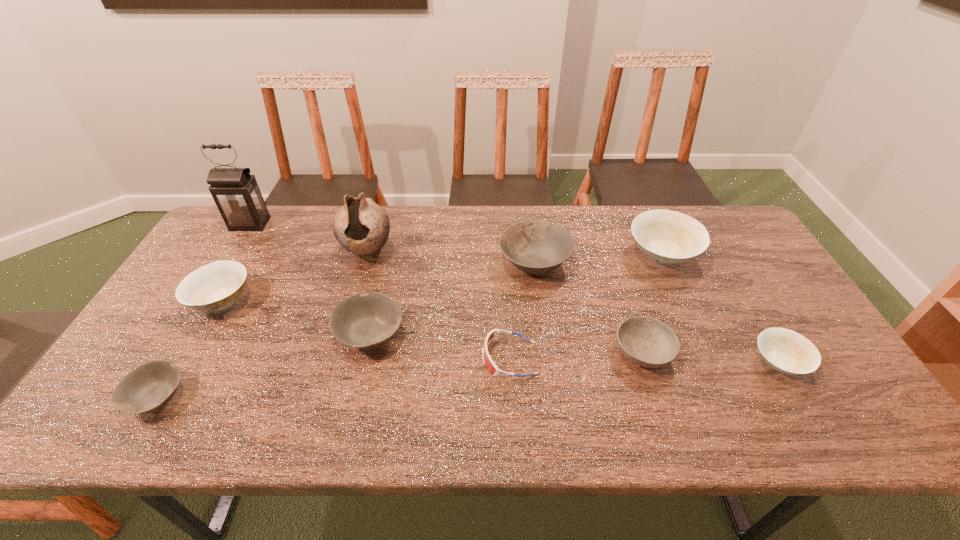
Identify the location of free space located on the front-facing side of the red goggles. This screenshot has height=540, width=960. (442, 358).

The image size is (960, 540). What are the coordinates of `vacant space located 0.170m on the front-facing side of the red goggles` in the screenshot? It's located at (414, 358).

Locate an element on the screen. This screenshot has width=960, height=540. free space located 0.190m on the front-facing side of the red goggles is located at coordinates (406, 358).

The height and width of the screenshot is (540, 960). Find the location of `free space located 0.280m on the right of the leftmost gray bowl`. free space located 0.280m on the right of the leftmost gray bowl is located at coordinates (307, 397).

The width and height of the screenshot is (960, 540). I want to click on lantern that is at the far edge, so click(236, 193).

The image size is (960, 540). I want to click on pottery present at the far edge, so click(x=361, y=226).

Where is `object located at the near edge`? Image resolution: width=960 pixels, height=540 pixels. object located at the near edge is located at coordinates (146, 388).

You are a GUI agent. You are given a task and a screenshot of the screen. Output one action in this format:
    pyautogui.click(x=<x>, y=<y>)
    Task: Click on the lantern that is positioned at the left edge
    The height and width of the screenshot is (540, 960).
    Given the screenshot: What is the action you would take?
    pyautogui.click(x=236, y=193)

This screenshot has height=540, width=960. In order to click on object that is at the right edge in this screenshot , I will do `click(786, 351)`.

Identify the location of object situated at the far left corner. (236, 193).